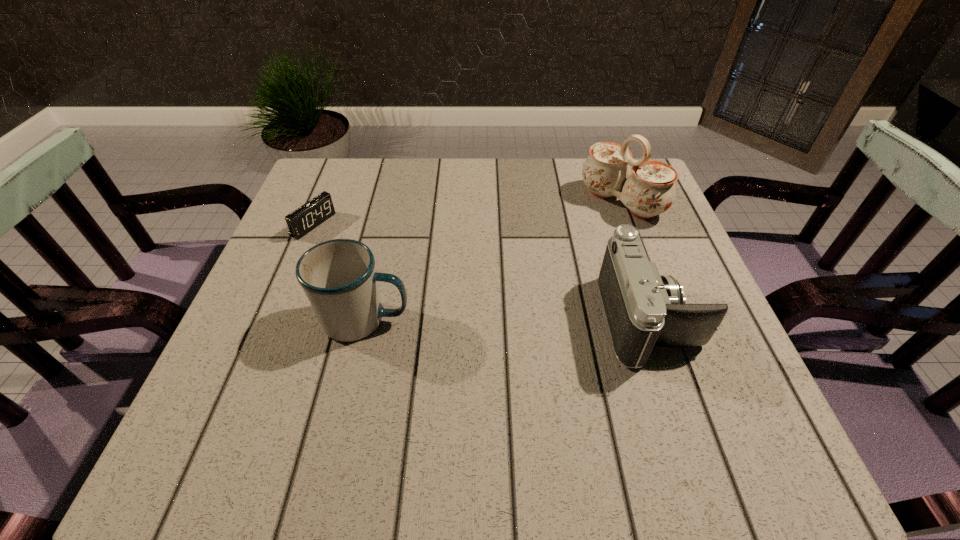
The width and height of the screenshot is (960, 540). Find the location of `vacant spot on the desktop that is between the mug and the camera and is positioned on the front-facing side of the leftmost object`. vacant spot on the desktop that is between the mug and the camera and is positioned on the front-facing side of the leftmost object is located at coordinates (504, 320).

Locate an element on the screen. vacant space on the desktop that is between the second object from left to right and the camera and is positioned by the handle of the chinaware is located at coordinates (466, 320).